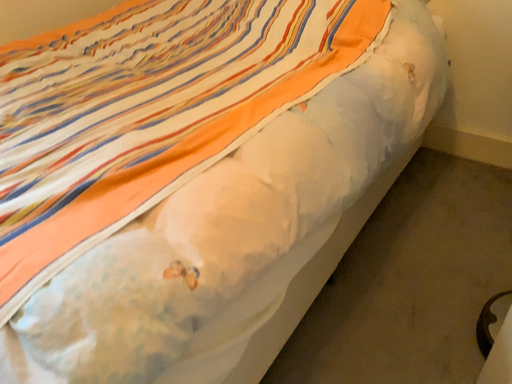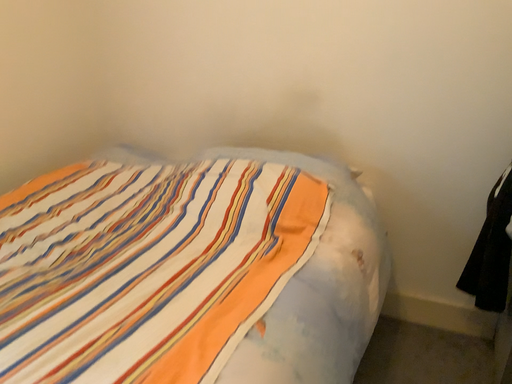
Question: How did the camera likely rotate when shooting the video?

Choices:
 (A) rotated right
 (B) rotated left

Answer: (A)